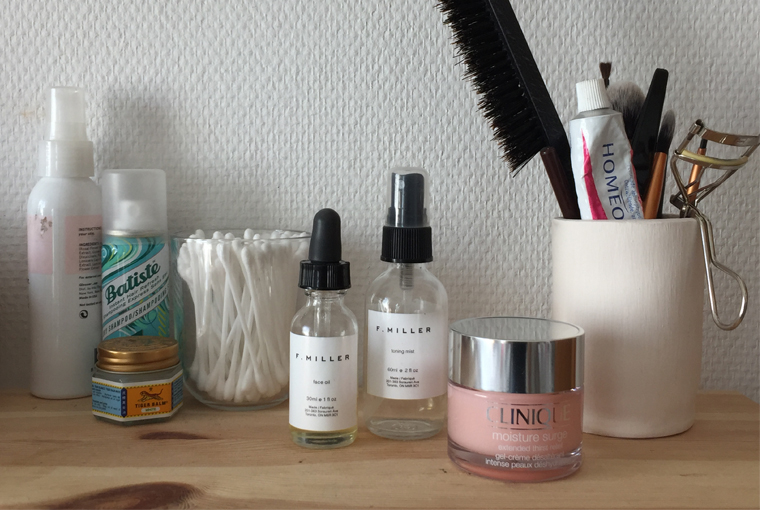
Image resolution: width=760 pixels, height=510 pixels. I want to click on transparent bottles, so click(340, 323), click(426, 298).